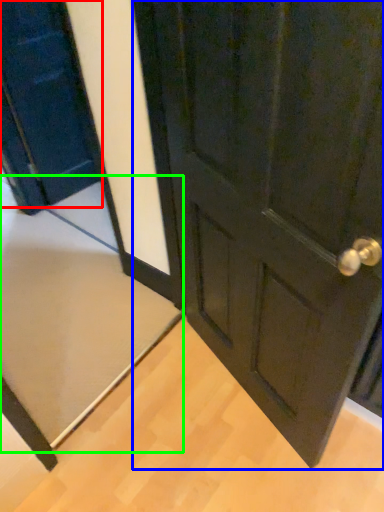
Question: Which is nearer to the door (highlighted by a red box)? door (highlighted by a blue box) or doormat (highlighted by a green box).

Choices:
 (A) door
 (B) doormat

Answer: (B)